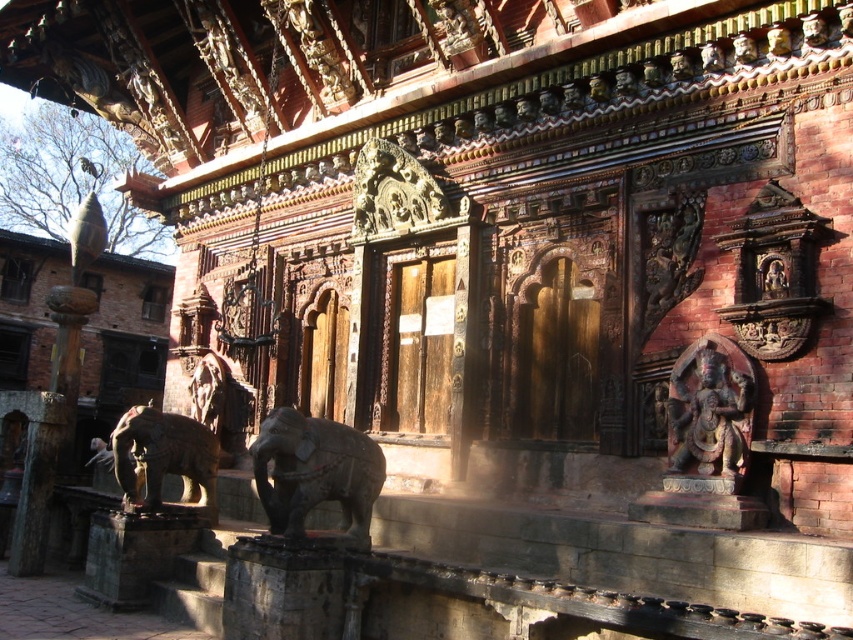
Question: Where is polished red stone statue at right located in relation to carved wood statue at center in the image?

Choices:
 (A) right
 (B) left

Answer: (A)

Question: Which object is the farthest from the polished stone elephant at center?

Choices:
 (A) carved wood statue at center
 (B) polished red stone statue at right
 (C) brown stone elephant at lower left

Answer: (A)

Question: Can you confirm if polished red stone statue at right is thinner than brown stone elephant at lower left?

Choices:
 (A) no
 (B) yes

Answer: (B)

Question: Does polished red stone statue at right come in front of brown stone elephant at lower left?

Choices:
 (A) yes
 (B) no

Answer: (A)

Question: Which point appears farthest from the camera in this image?

Choices:
 (A) (140, 438)
 (B) (354, 211)

Answer: (B)

Question: Among these objects, which one is farthest from the camera?

Choices:
 (A) polished stone elephant at center
 (B) brown stone elephant at lower left
 (C) carved wood statue at center

Answer: (C)